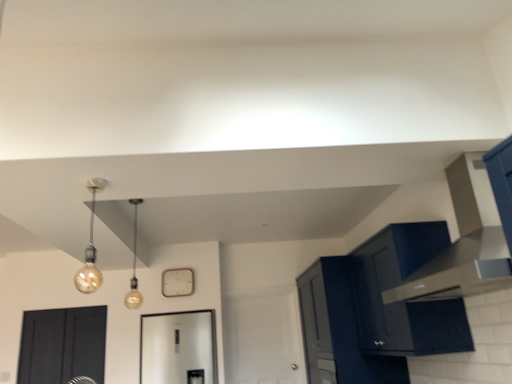
Question: From the image's perspective, is matte dark blue cabinet at upper right, the second cabinetry viewed from the front, above matte gold bulb at upper left, placed as the first light fixture when sorted from front to back?

Choices:
 (A) yes
 (B) no

Answer: (B)

Question: Is matte dark blue cabinet at upper right, which is the 1th cabinetry from back to front, completely or partially outside of matte gold bulb at upper left, placed as the first light fixture when sorted from front to back?

Choices:
 (A) no
 (B) yes

Answer: (B)

Question: Considering the relative positions of matte dark blue cabinet at upper right, which is the 1th cabinetry from back to front, and matte gold bulb at upper left, the 2th light fixture positioned from the back, in the image provided, is matte dark blue cabinet at upper right, which is the 1th cabinetry from back to front, in front of matte gold bulb at upper left, the 2th light fixture positioned from the back,?

Choices:
 (A) yes
 (B) no

Answer: (B)

Question: Could you tell me if matte dark blue cabinet at upper right, which is the 1th cabinetry from back to front, is turned towards matte gold bulb at upper left, the 2th light fixture positioned from the back?

Choices:
 (A) no
 (B) yes

Answer: (A)

Question: Considering the relative sizes of matte dark blue cabinet at upper right, the second cabinetry viewed from the front, and matte gold bulb at upper left, placed as the first light fixture when sorted from front to back, in the image provided, is matte dark blue cabinet at upper right, the second cabinetry viewed from the front, smaller than matte gold bulb at upper left, placed as the first light fixture when sorted from front to back,?

Choices:
 (A) yes
 (B) no

Answer: (B)

Question: From a real-world perspective, is matte dark blue cabinet at upper right, which is the 1th cabinetry from back to front, positioned under matte gold bulb at upper left, placed as the first light fixture when sorted from front to back, based on gravity?

Choices:
 (A) yes
 (B) no

Answer: (A)

Question: Is matte gold bulb at upper left, placed as the first light fixture when sorted from front to back, to the right of matte glass bulb at center, which is counted as the first light fixture, starting from the back, from the viewer's perspective?

Choices:
 (A) yes
 (B) no

Answer: (A)

Question: Is matte gold bulb at upper left, the 2th light fixture positioned from the back, taller than matte glass bulb at center, which is counted as the first light fixture, starting from the back?

Choices:
 (A) yes
 (B) no

Answer: (B)

Question: Could you tell me if matte gold bulb at upper left, placed as the first light fixture when sorted from front to back, is turned towards matte glass bulb at center, marked as the 2th light fixture in a front-to-back arrangement?

Choices:
 (A) yes
 (B) no

Answer: (B)

Question: Would you consider matte gold bulb at upper left, the 2th light fixture positioned from the back, to be distant from matte glass bulb at center, marked as the 2th light fixture in a front-to-back arrangement?

Choices:
 (A) no
 (B) yes

Answer: (A)

Question: Can you confirm if matte gold bulb at upper left, placed as the first light fixture when sorted from front to back, is shorter than matte glass bulb at center, marked as the 2th light fixture in a front-to-back arrangement?

Choices:
 (A) no
 (B) yes

Answer: (B)

Question: From the image's perspective, does matte gold bulb at upper left, the 2th light fixture positioned from the back, appear higher than matte glass bulb at center, marked as the 2th light fixture in a front-to-back arrangement?

Choices:
 (A) no
 (B) yes

Answer: (B)

Question: From the image's perspective, does matte black vent at upper right appear lower than matte gold bulb at upper left, the 2th light fixture positioned from the back?

Choices:
 (A) yes
 (B) no

Answer: (B)